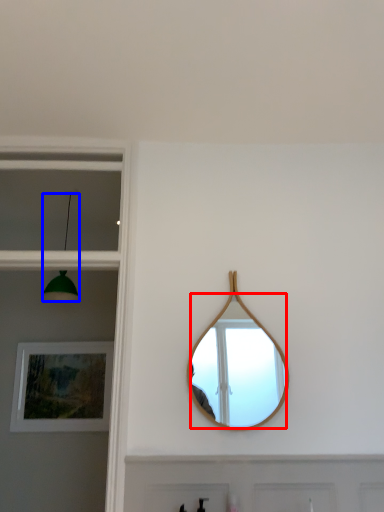
Question: Which of the following is the farthest to the observer, mirror (highlighted by a red box) or light fixture (highlighted by a blue box)?

Choices:
 (A) mirror
 (B) light fixture

Answer: (B)